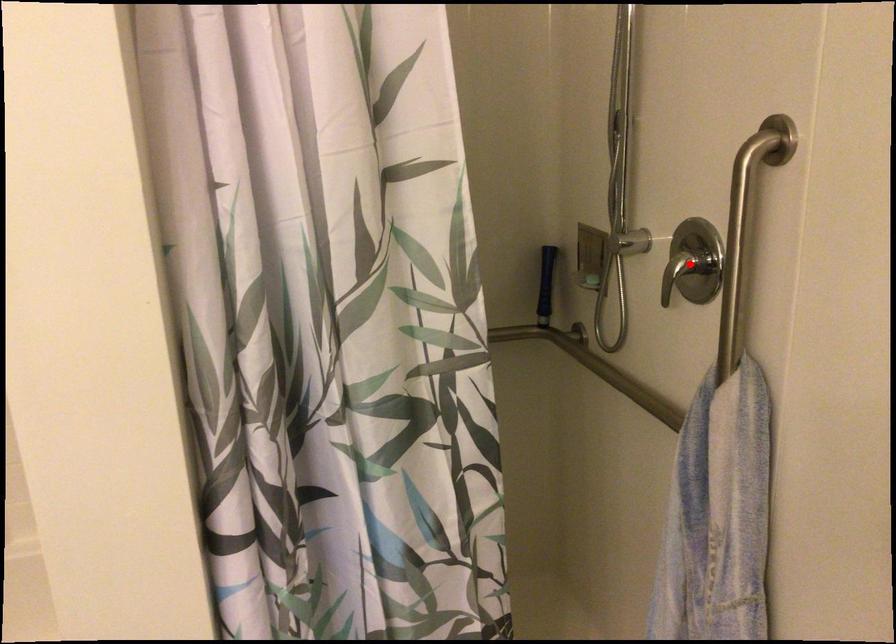
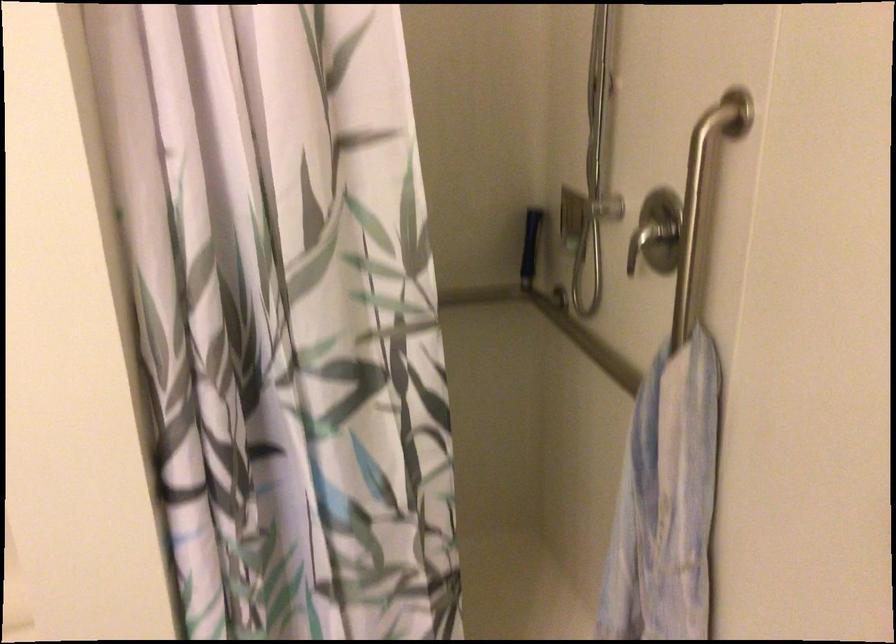
Where in the second image is the point corresponding to the highlighted location from the first image?

(650, 240)